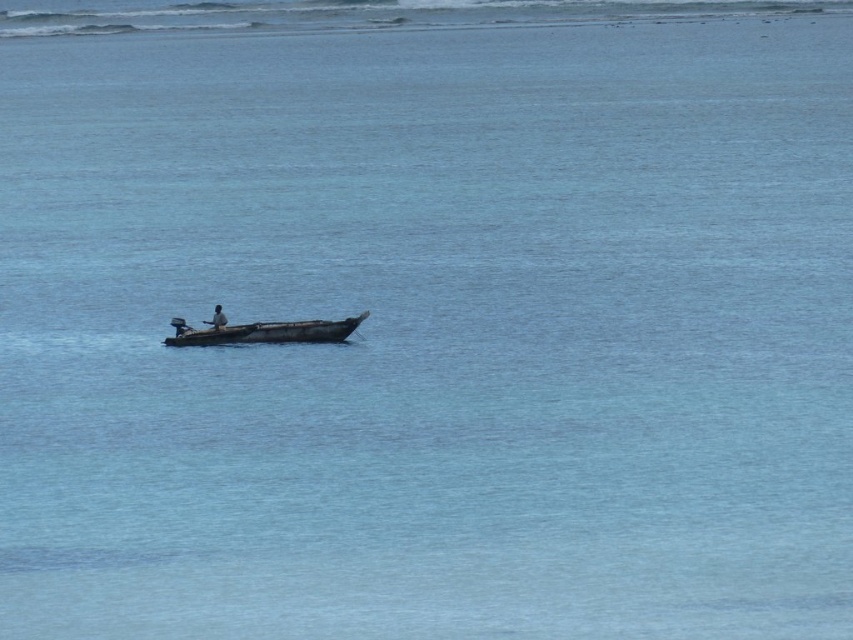
You are standing on the shore and see the wooden boat at center and the dark skin person at center. Which object is closer to your right side?

The wooden boat at center is to the right of dark skin person at center, so the wooden boat at center is closer to your right side.